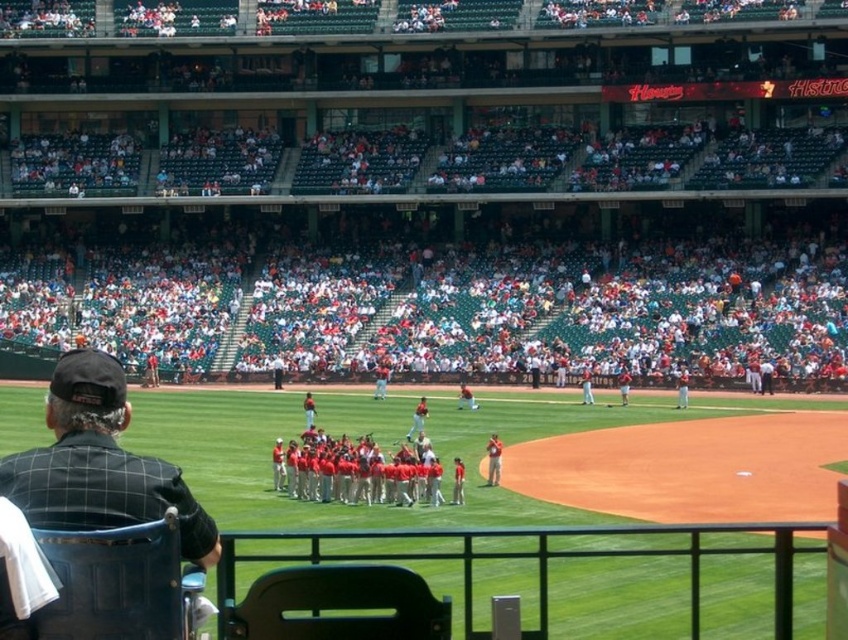
You are standing at the center of the baseball field and want to sit down. Where is the black mesh chair at lower left located relative to your current position?

The black mesh chair at lower left is located at point (99, 464) relative to your position at the center of the baseball field.

Based on the photo, you are a photographer standing at the edge of the baseball field. You want to take a photo that includes both the black mesh chair at lower left and the red uniformed players at center. Considering their sizes, which object should you position closer to the camera to ensure both are clearly visible in the frame?

The black mesh chair at lower left is larger in size compared to the red uniformed players at center. To ensure both are clearly visible, position the black mesh chair at lower left closer to the camera since its larger size will occupy more space in the frame, while the smaller red uniformed players at center can be placed further back but still within view.

You are a photographer standing at the edge of the baseball field. You want to take a photo that includes both the black mesh chair at lower left and the red uniformed players at center. Based on their positions, which object should you adjust your camera angle to focus on first to ensure both are in frame?

The black mesh chair at lower left is positioned on the left side of red uniformed players at center. To include both in the frame, focus on the black mesh chair at lower left first since it is further to the left, then adjust the camera angle to include the red uniformed players at center on the right side.